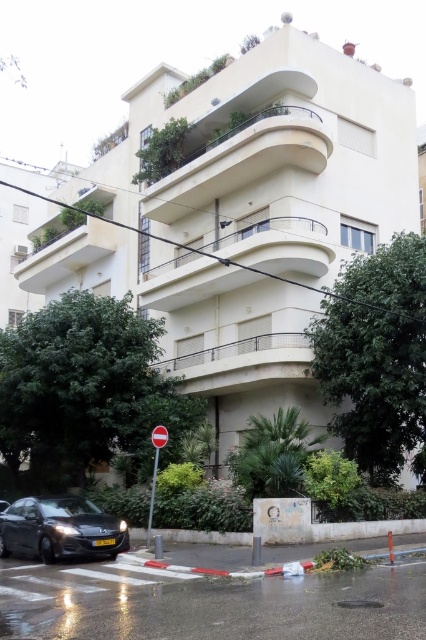
Is shiny black car at lower left positioned behind red plastic sign at center?

No.

Is shiny black car at lower left wider than red plastic sign at center?

Correct, the width of shiny black car at lower left exceeds that of red plastic sign at center.

This screenshot has height=640, width=426. Find the location of `shiny black car at lower left`. shiny black car at lower left is located at coordinates (60, 529).

Is point (164, 433) behind point (157, 429)?

No, (164, 433) is closer to viewer.

Can you confirm if red plastic sign at center is taller than red plastic stop sign at center?

Correct, red plastic sign at center is much taller as red plastic stop sign at center.

Between point (154, 499) and point (163, 435), which one is positioned behind?

Point (154, 499)

Where is `red plastic sign at center`? The width and height of the screenshot is (426, 640). red plastic sign at center is located at coordinates (155, 468).

Is point (112, 532) positioned before point (163, 440)?

Yes, it is.

Is shiny black car at lower left wider than red plastic stop sign at center?

Yes.

Who is more distant from viewer, (69, 532) or (164, 444)?

Point (164, 444)

Find the location of a particular element. This screenshot has width=426, height=640. shiny black car at lower left is located at coordinates (60, 529).